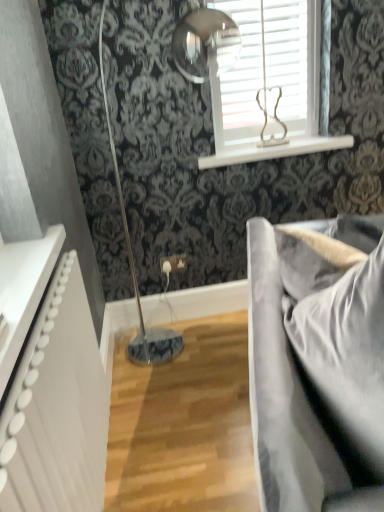
Question: Considering the relative sizes of white glossy window sill at upper center and satin grey fabric couch at right in the image provided, is white glossy window sill at upper center shorter than satin grey fabric couch at right?

Choices:
 (A) no
 (B) yes

Answer: (B)

Question: From a real-world perspective, is white glossy window sill at upper center located beneath satin grey fabric couch at right?

Choices:
 (A) no
 (B) yes

Answer: (A)

Question: Is white glossy window sill at upper center not inside satin grey fabric couch at right?

Choices:
 (A) yes
 (B) no

Answer: (A)

Question: Can you confirm if white glossy window sill at upper center is bigger than satin grey fabric couch at right?

Choices:
 (A) yes
 (B) no

Answer: (B)

Question: Is white glossy window sill at upper center positioned with its back to satin grey fabric couch at right?

Choices:
 (A) yes
 (B) no

Answer: (B)

Question: Is white glossy window sill at upper center wider or thinner than white wooden blinds at upper center?

Choices:
 (A) thin
 (B) wide

Answer: (B)

Question: Is white glossy window sill at upper center in front of or behind white wooden blinds at upper center in the image?

Choices:
 (A) behind
 (B) front

Answer: (A)

Question: Is point (259, 156) closer or farther from the camera than point (236, 113)?

Choices:
 (A) closer
 (B) farther

Answer: (A)

Question: Is white glossy window sill at upper center to the left or to the right of white wooden blinds at upper center in the image?

Choices:
 (A) left
 (B) right

Answer: (B)

Question: Considering the positions of satin grey fabric couch at right and white wooden blinds at upper center in the image, is satin grey fabric couch at right taller or shorter than white wooden blinds at upper center?

Choices:
 (A) tall
 (B) short

Answer: (A)

Question: Is satin grey fabric couch at right spatially inside white wooden blinds at upper center, or outside of it?

Choices:
 (A) inside
 (B) outside

Answer: (B)

Question: From a real-world perspective, is satin grey fabric couch at right physically located above or below white wooden blinds at upper center?

Choices:
 (A) below
 (B) above

Answer: (A)

Question: From the image's perspective, is satin grey fabric couch at right positioned above or below white wooden blinds at upper center?

Choices:
 (A) above
 (B) below

Answer: (B)

Question: From the image's perspective, is white wooden blinds at upper center above or below satin grey fabric couch at right?

Choices:
 (A) below
 (B) above

Answer: (B)

Question: Visually, is white wooden blinds at upper center positioned to the left or to the right of satin grey fabric couch at right?

Choices:
 (A) right
 (B) left

Answer: (B)